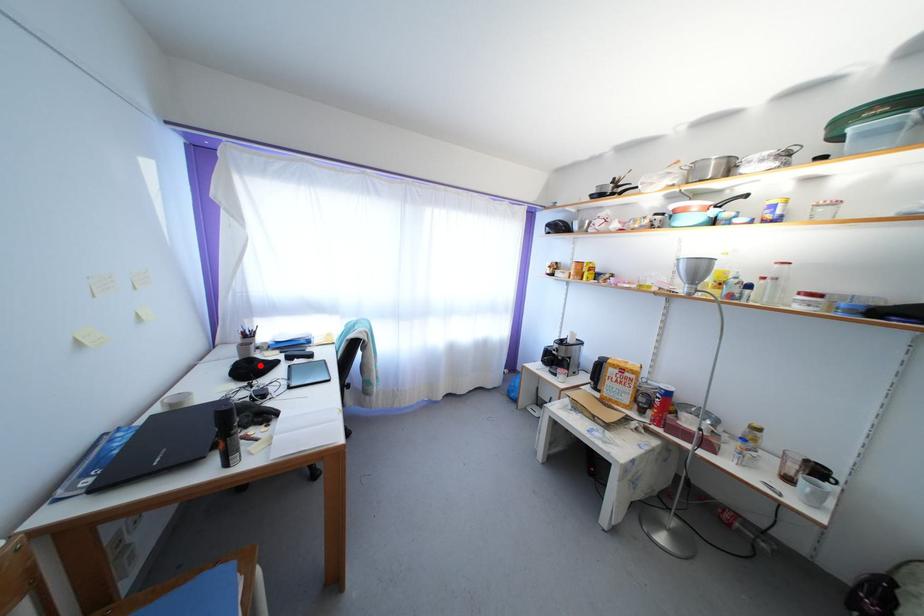
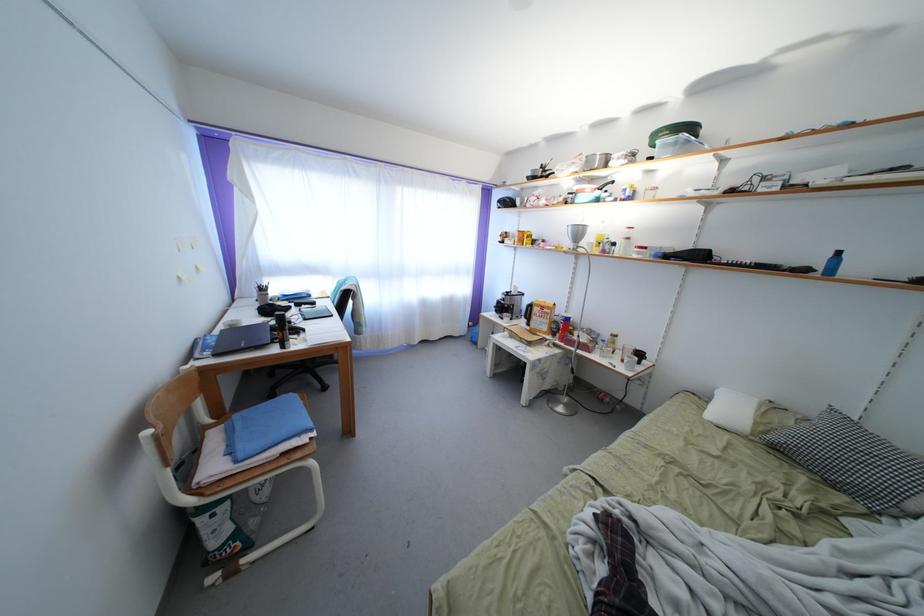
Locate, in the second image, the point that corresponds to the highlighted location in the first image.

(277, 310)